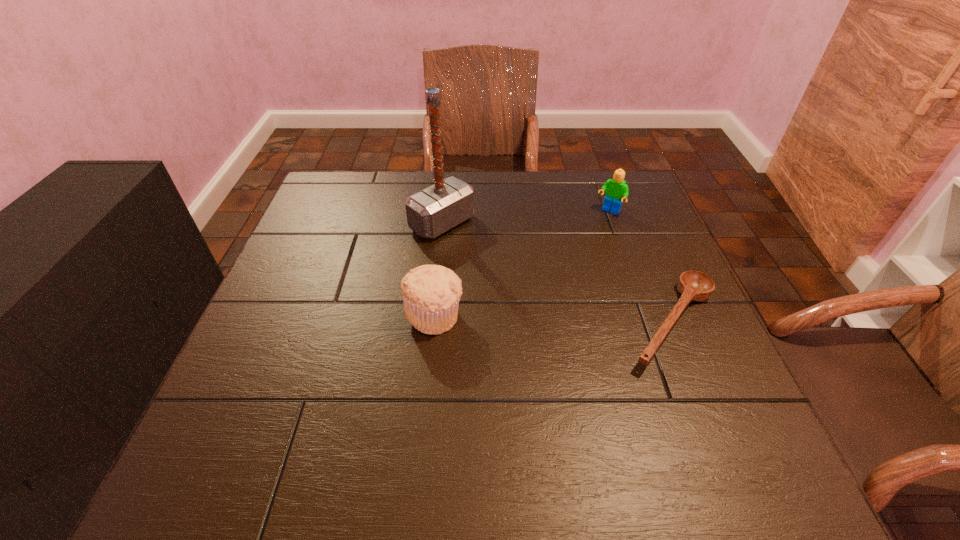
Select which object appears as the third closest to the Lego. Please provide its 2D coordinates. Your answer should be formatted as a tuple, i.e. [(x, y)], where the tuple contains the x and y coordinates of a point satisfying the conditions above.

[(431, 293)]

Locate which object is the third closest to the tallest object. Please provide its 2D coordinates. Your answer should be formatted as a tuple, i.e. [(x, y)], where the tuple contains the x and y coordinates of a point satisfying the conditions above.

[(693, 285)]

This screenshot has height=540, width=960. I want to click on free point that satisfies the following two spatial constraints: 1. on the front side of the shortest object; 2. on the right side of the tallest object, so click(x=432, y=323).

You are a GUI agent. You are given a task and a screenshot of the screen. Output one action in this format:
    pyautogui.click(x=<x>, y=<y>)
    Task: Click on the vacant space that satisfies the following two spatial constraints: 1. on the back side of the muffin; 2. on the right side of the Lego
    
    Given the screenshot: What is the action you would take?
    pyautogui.click(x=444, y=212)

Where is `vacant space that satisfies the following two spatial constraints: 1. on the front side of the hammer; 2. on the right side of the shortest object`? vacant space that satisfies the following two spatial constraints: 1. on the front side of the hammer; 2. on the right side of the shortest object is located at coordinates (432, 323).